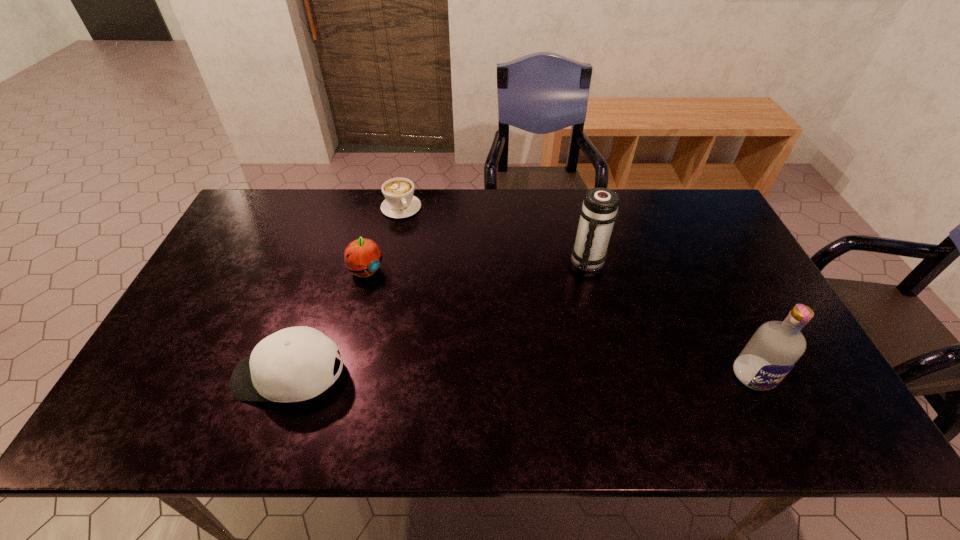
Find the location of a particular element. This screenshot has width=960, height=540. baseball cap is located at coordinates (x=294, y=364).

This screenshot has width=960, height=540. I want to click on vodka, so click(x=776, y=347).

Where is `thermos bottle`? thermos bottle is located at coordinates (x=599, y=210).

Locate an element on the screen. apple is located at coordinates (362, 257).

Locate an element on the screen. This screenshot has height=540, width=960. the shortest object is located at coordinates (399, 202).

Image resolution: width=960 pixels, height=540 pixels. Find the location of `the farthest object`. the farthest object is located at coordinates (399, 202).

Where is `vacant space located 0.060m on the front-facing side of the baseball cap`? The height and width of the screenshot is (540, 960). vacant space located 0.060m on the front-facing side of the baseball cap is located at coordinates (210, 376).

Identify the location of blank area located 0.050m on the front-facing side of the baseball cap. (214, 376).

Find the location of a particular element. The width and height of the screenshot is (960, 540). free space located 0.090m on the front-facing side of the baseball cap is located at coordinates (198, 376).

This screenshot has height=540, width=960. In order to click on free space located on the side with the handle of the thermos bottle in this screenshot , I will do `click(585, 306)`.